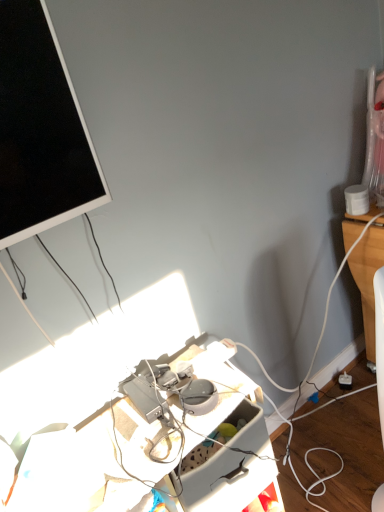
Question: Does matte black screen at upper left appear on the right side of plastic gray desk at center?

Choices:
 (A) yes
 (B) no

Answer: (B)

Question: Does matte black screen at upper left contain plastic gray desk at center?

Choices:
 (A) yes
 (B) no

Answer: (B)

Question: Is matte black screen at upper left wider than plastic gray desk at center?

Choices:
 (A) no
 (B) yes

Answer: (A)

Question: Considering the relative sizes of matte black screen at upper left and plastic gray desk at center in the image provided, is matte black screen at upper left thinner than plastic gray desk at center?

Choices:
 (A) no
 (B) yes

Answer: (B)

Question: Can you confirm if matte black screen at upper left is bigger than plastic gray desk at center?

Choices:
 (A) yes
 (B) no

Answer: (A)

Question: Is matte black screen at upper left turned away from plastic gray desk at center?

Choices:
 (A) yes
 (B) no

Answer: (B)

Question: Is white plastic power outlet at lower right aimed at matte black screen at upper left?

Choices:
 (A) yes
 (B) no

Answer: (B)

Question: From a real-world perspective, is white plastic power outlet at lower right on top of matte black screen at upper left?

Choices:
 (A) no
 (B) yes

Answer: (A)

Question: Is white plastic power outlet at lower right positioned in front of matte black screen at upper left?

Choices:
 (A) yes
 (B) no

Answer: (B)

Question: From a real-world perspective, is white plastic power outlet at lower right positioned under matte black screen at upper left based on gravity?

Choices:
 (A) no
 (B) yes

Answer: (B)

Question: Considering the relative sizes of white plastic power outlet at lower right and matte black screen at upper left in the image provided, is white plastic power outlet at lower right smaller than matte black screen at upper left?

Choices:
 (A) yes
 (B) no

Answer: (A)

Question: Can you confirm if white plastic power outlet at lower right is shorter than matte black screen at upper left?

Choices:
 (A) yes
 (B) no

Answer: (A)

Question: Does plastic gray desk at center come in front of matte black screen at upper left?

Choices:
 (A) no
 (B) yes

Answer: (A)